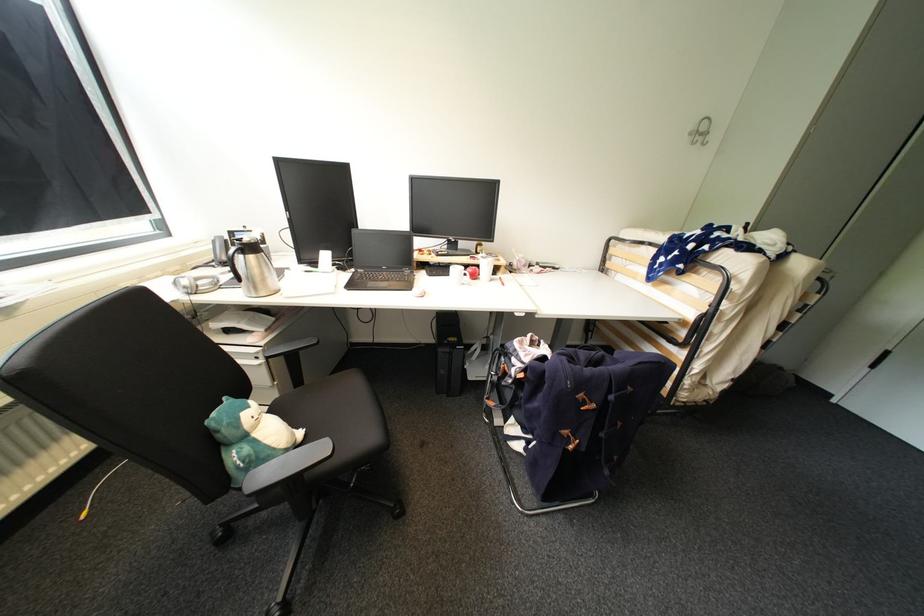
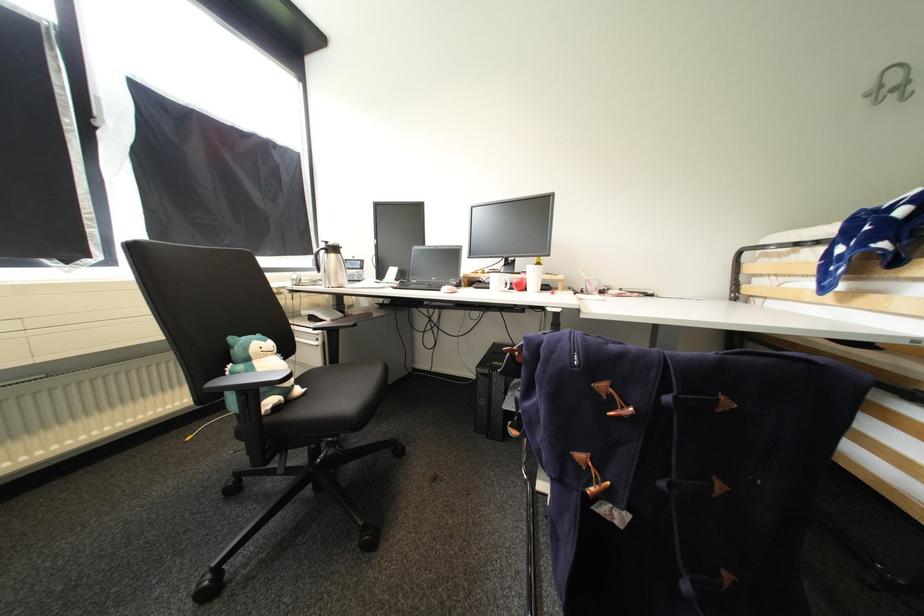
Where in the second image is the point corresponding to pixel 711 135 from the first image?

(912, 84)